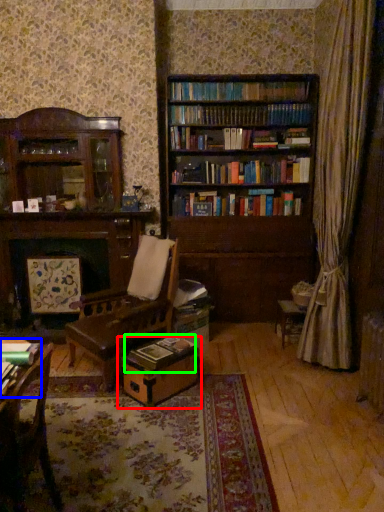
Question: Considering the real-world distances, which object is farthest from cardboard box (highlighted by a red box)? book (highlighted by a blue box) or book (highlighted by a green box)?

Choices:
 (A) book
 (B) book

Answer: (A)